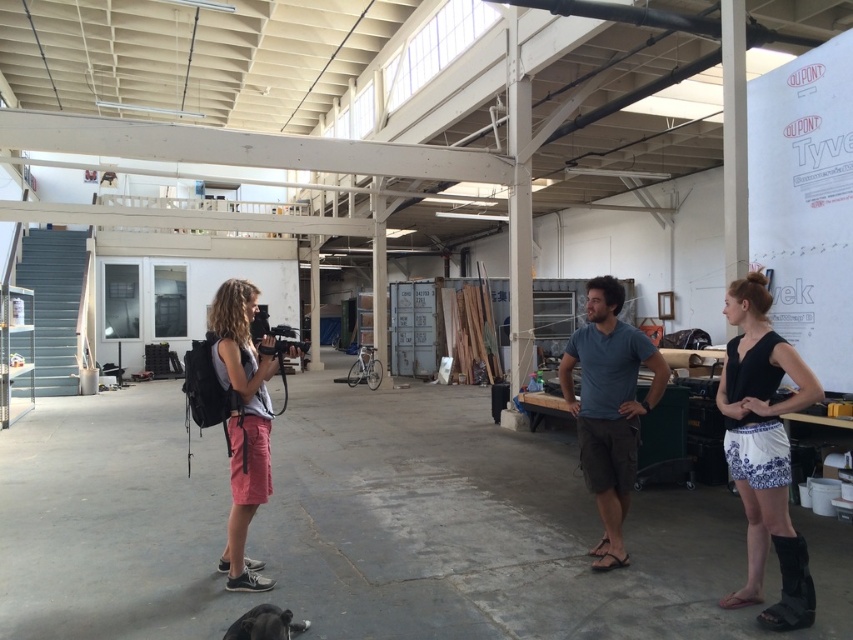
You are a photographer setting up a shoot in this industrial space. You notice the black matte shorts at right and the blue cotton shirt at center. Which item is positioned lower in the scene?

The black matte shorts at right is below blue cotton shirt at center, so the black matte shorts at right is positioned lower in the scene.

You are a photographer standing in the warehouse. You have a camera and need to reach the black matte shorts at right to adjust them. Can you comfortably reach them without moving your feet?

The distance between the camera and the black matte shorts at right is 3.11 meters, so you cannot comfortably reach them without moving your feet since the distance is too far.